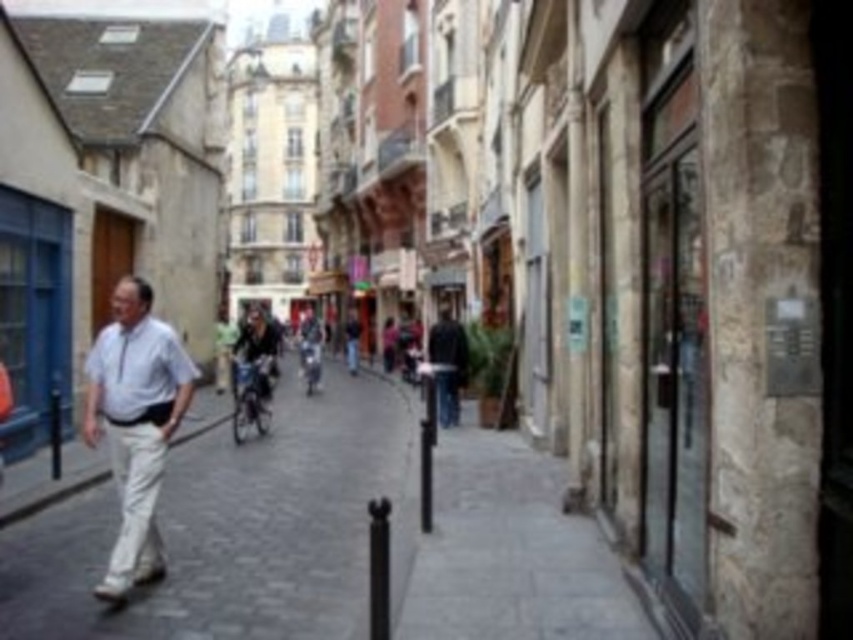
Question: Which point is farther to the camera?

Choices:
 (A) (71, 628)
 (B) (183, 365)
 (C) (306, 317)

Answer: (C)

Question: Where is gray cobblestone pavement at center located in relation to dark blue jacket at center in the image?

Choices:
 (A) above
 (B) below

Answer: (B)

Question: Which point is farther to the camera?

Choices:
 (A) matte gray jacket at center
 (B) gray cobblestone pavement at center

Answer: (A)

Question: Can you confirm if white cotton shirt at center is wider than dark blue jacket at center?

Choices:
 (A) yes
 (B) no

Answer: (A)

Question: Which of these objects is positioned farthest from the white cotton shirt at center?

Choices:
 (A) matte gray jacket at center
 (B) gray cobblestone pavement at center

Answer: (A)

Question: Is dark blue jacket at center positioned in front of matte gray jacket at center?

Choices:
 (A) yes
 (B) no

Answer: (A)